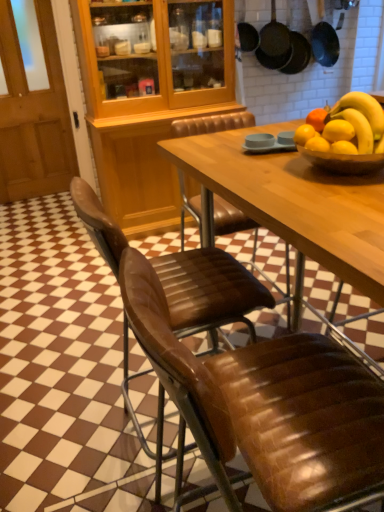
Question: Considering the relative positions of black matte frying pan at upper right, the third frying pan when ordered from right to left, and wooden door at left in the image provided, is black matte frying pan at upper right, the third frying pan when ordered from right to left, to the left of wooden door at left from the viewer's perspective?

Choices:
 (A) no
 (B) yes

Answer: (A)

Question: Does black matte frying pan at upper right, arranged as the first frying pan when viewed from the left, come behind wooden door at left?

Choices:
 (A) no
 (B) yes

Answer: (B)

Question: Are black matte frying pan at upper right, the third frying pan when ordered from right to left, and wooden door at left making contact?

Choices:
 (A) yes
 (B) no

Answer: (B)

Question: Is black matte frying pan at upper right, arranged as the first frying pan when viewed from the left, wider than wooden door at left?

Choices:
 (A) no
 (B) yes

Answer: (B)

Question: Can you confirm if black matte frying pan at upper right, the third frying pan when ordered from right to left, is bigger than wooden door at left?

Choices:
 (A) yes
 (B) no

Answer: (B)

Question: From the image's perspective, is black matte frying pan at upper right, the third frying pan when ordered from right to left, under wooden door at left?

Choices:
 (A) yes
 (B) no

Answer: (B)

Question: Is brown leather chair at center, which appears as the first chair when viewed from the back, bigger than black matte frying pan at upper right, arranged as the first frying pan when viewed from the left?

Choices:
 (A) yes
 (B) no

Answer: (A)

Question: Is brown leather chair at center, which appears as the first chair when viewed from the back, positioned in front of black matte frying pan at upper right, the third frying pan when ordered from right to left?

Choices:
 (A) no
 (B) yes

Answer: (B)

Question: Considering the relative positions of brown leather chair at center, which appears as the first chair when viewed from the back, and black matte frying pan at upper right, arranged as the first frying pan when viewed from the left, in the image provided, is brown leather chair at center, which appears as the first chair when viewed from the back, to the right of black matte frying pan at upper right, arranged as the first frying pan when viewed from the left, from the viewer's perspective?

Choices:
 (A) no
 (B) yes

Answer: (A)

Question: Considering the relative sizes of brown leather chair at center, which appears as the first chair when viewed from the back, and black matte frying pan at upper right, the third frying pan when ordered from right to left, in the image provided, is brown leather chair at center, which appears as the first chair when viewed from the back, thinner than black matte frying pan at upper right, the third frying pan when ordered from right to left,?

Choices:
 (A) no
 (B) yes

Answer: (A)

Question: Is brown leather chair at center, which is counted as the second chair, starting from the front, completely or partially outside of black matte frying pan at upper right, the third frying pan when ordered from right to left?

Choices:
 (A) yes
 (B) no

Answer: (A)

Question: From the image's perspective, is brown leather chair at center, which appears as the first chair when viewed from the back, beneath black matte frying pan at upper right, the third frying pan when ordered from right to left?

Choices:
 (A) yes
 (B) no

Answer: (A)

Question: From the image's perspective, is black matte frying pan at upper right, the third frying pan when ordered from right to left, above black matte frying pan at upper right, which is counted as the third frying pan, starting from the left?

Choices:
 (A) no
 (B) yes

Answer: (B)